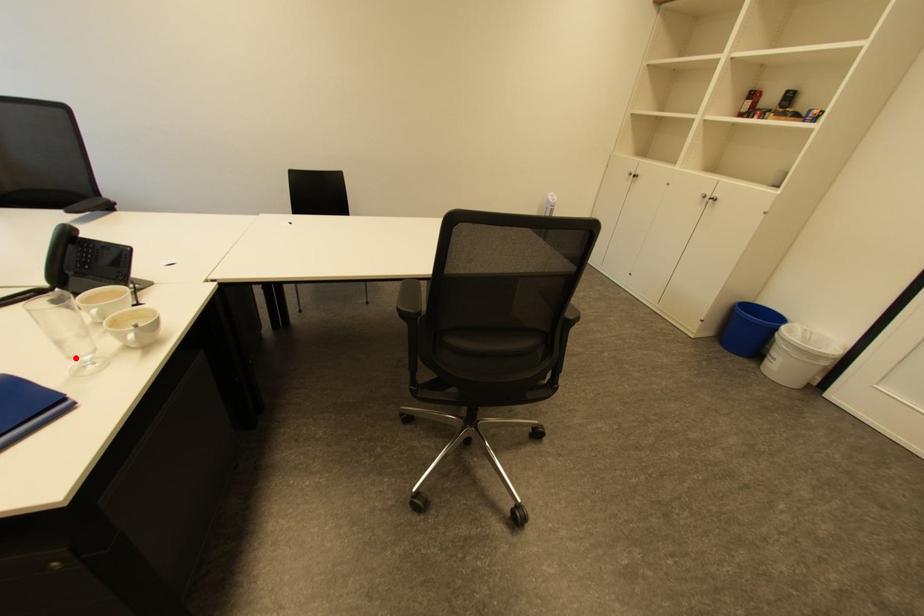
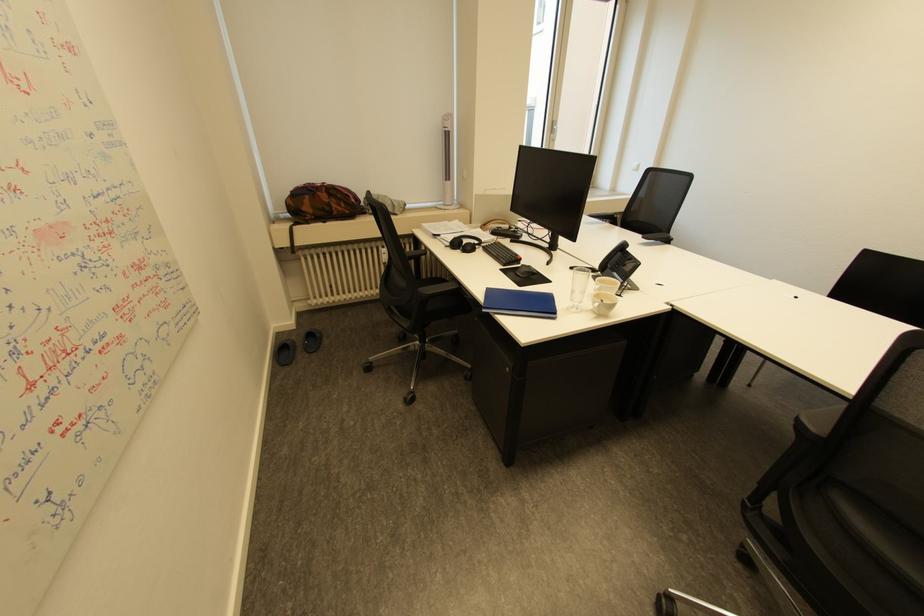
Question: I am providing you with two images of the same scene from different viewpoints. A red point is marked on the first image. Is the red point's position out of view in image 2?

Choices:
 (A) Yes
 (B) No

Answer: (B)